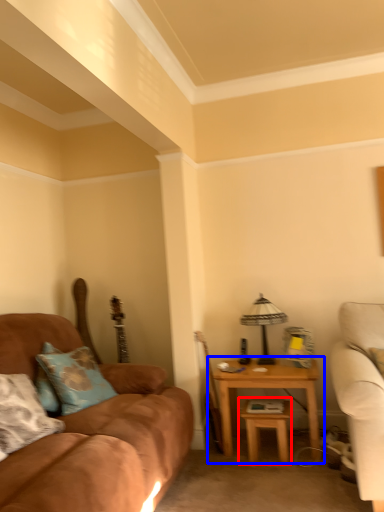
Question: Which of the following is the farthest to the observer, table (highlighted by a red box) or table (highlighted by a blue box)?

Choices:
 (A) table
 (B) table

Answer: (B)